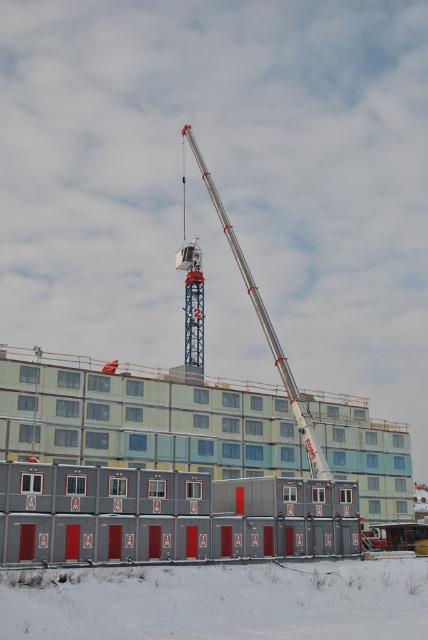
Question: Which point is farther from the camera taking this photo?

Choices:
 (A) (21, 582)
 (B) (253, 294)

Answer: (B)

Question: Which point appears closest to the camera in this image?

Choices:
 (A) (303, 413)
 (B) (318, 595)

Answer: (B)

Question: Can you confirm if white powdery snow at lower center is wider than silver metallic crane at center?

Choices:
 (A) yes
 (B) no

Answer: (A)

Question: Is white powdery snow at lower center below silver metallic crane at center?

Choices:
 (A) no
 (B) yes

Answer: (B)

Question: Is white powdery snow at lower center smaller than silver metallic crane at center?

Choices:
 (A) yes
 (B) no

Answer: (A)